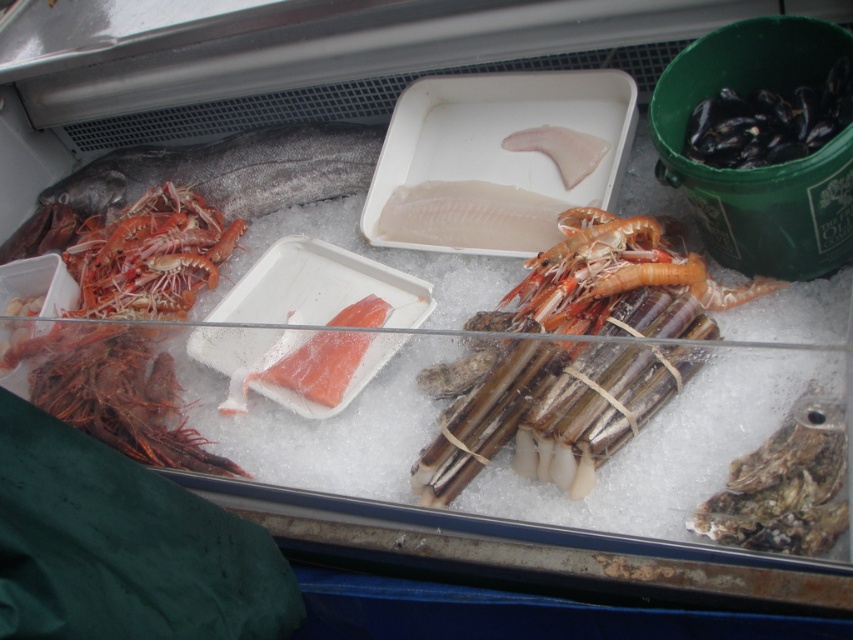
You are a customer at a seafood market and want to buy the taller seafood item between the shiny orange shrimp at center and the shiny orange prawns at left. Which one should you choose?

The shiny orange shrimp at center is much taller than the shiny orange prawns at left, so you should choose the shiny orange shrimp at center.